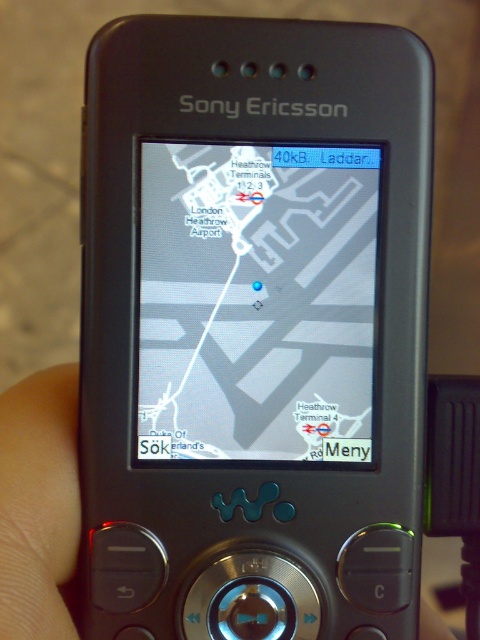
Question: Which of these objects is positioned closest to the matte gray map at center?

Choices:
 (A) skin/soft/hand at lower left
 (B) black matte sony ericsson phone at center

Answer: (B)

Question: Can you confirm if black matte sony ericsson phone at center is smaller than skin/soft/hand at lower left?

Choices:
 (A) no
 (B) yes

Answer: (A)

Question: Observing the image, what is the correct spatial positioning of black matte sony ericsson phone at center in reference to matte gray map at center?

Choices:
 (A) left
 (B) right

Answer: (A)

Question: Among these points, which one is nearest to the camera?

Choices:
 (A) (72, 461)
 (B) (338, 301)
 (C) (380, 124)

Answer: (C)

Question: Among these points, which one is nearest to the camera?

Choices:
 (A) (31, 584)
 (B) (237, 90)
 (C) (336, 358)

Answer: (A)

Question: Is black matte sony ericsson phone at center behind matte gray map at center?

Choices:
 (A) yes
 (B) no

Answer: (B)